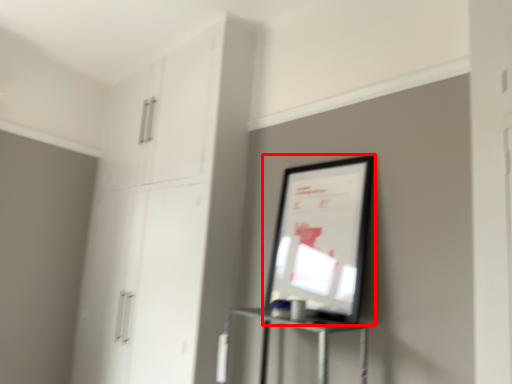
Question: From the image's perspective, what is the correct spatial relationship of picture frame (annotated by the red box) in relation to dresser?

Choices:
 (A) above
 (B) below

Answer: (A)